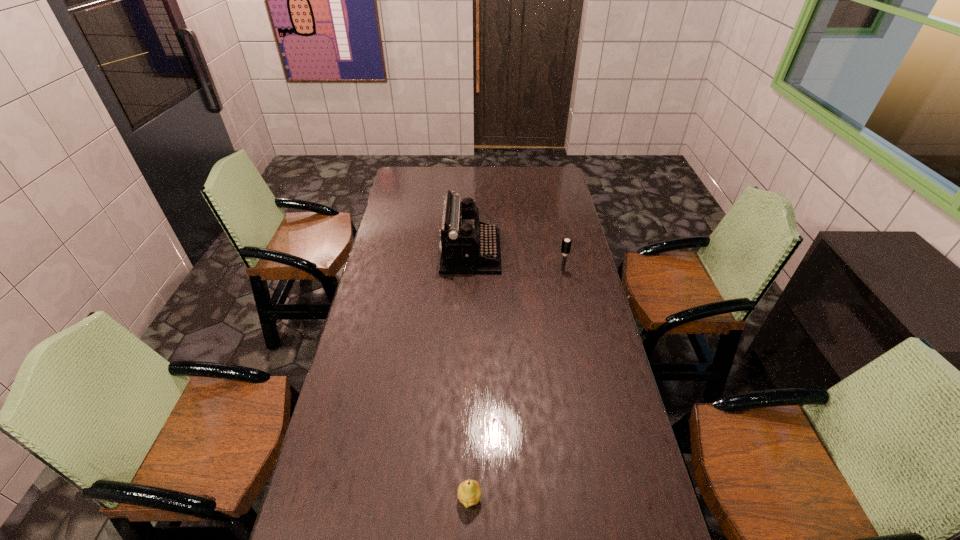
At what (x,y) coordinates should I click in order to perform the action: click on the tallest object. Please return your answer as a coordinate pair (x, y). The image size is (960, 540). Looking at the image, I should click on (468, 246).

In order to click on hairbrush in this screenshot , I will do `click(566, 244)`.

I want to click on the rightmost object, so click(566, 244).

You are a GUI agent. You are given a task and a screenshot of the screen. Output one action in this format:
    pyautogui.click(x=<x>, y=<y>)
    Task: Click on the nearest object
    
    Given the screenshot: What is the action you would take?
    pyautogui.click(x=469, y=493)

Locate an element on the screen. pear is located at coordinates (469, 493).

I want to click on vacant space located 0.150m on the typing side of the typewriter, so click(x=536, y=252).

The width and height of the screenshot is (960, 540). What are the coordinates of `vacant area situated on the left of the hairbrush` in the screenshot? It's located at (506, 271).

This screenshot has width=960, height=540. Identify the location of free space located on the left of the shortest object. (372, 498).

This screenshot has width=960, height=540. I want to click on object present at the right edge, so click(566, 244).

Locate an element on the screen. The image size is (960, 540). vacant position at the far edge of the desktop is located at coordinates (444, 173).